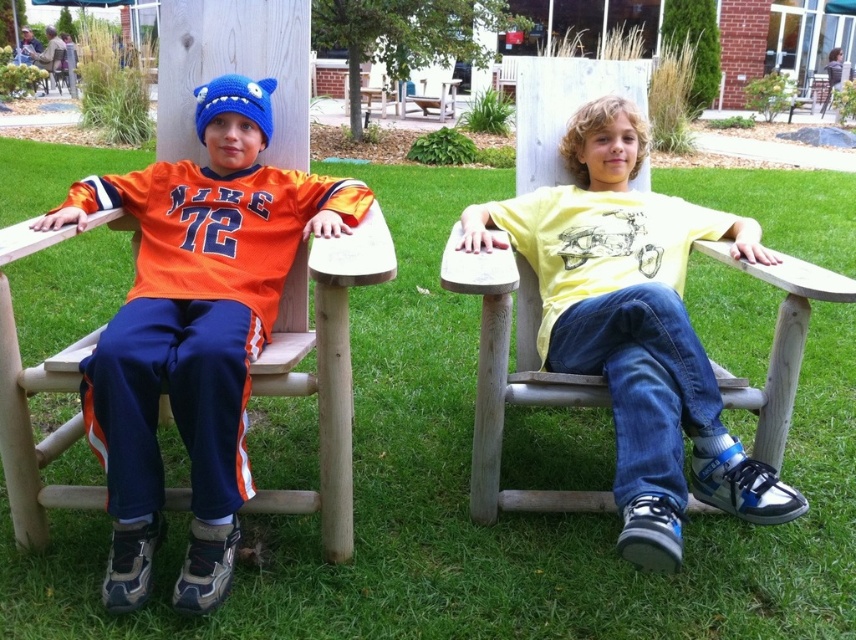
Between yellow matte shirt at center and orange jersey at left, which one has less height?

orange jersey at left

Looking at this image, does yellow matte shirt at center have a greater height compared to orange jersey at left?

Yes.

Between point (629, 534) and point (144, 202), which one is positioned behind?

Positioned behind is point (144, 202).

Find the location of `yellow matte shirt at center`. yellow matte shirt at center is located at coordinates (635, 326).